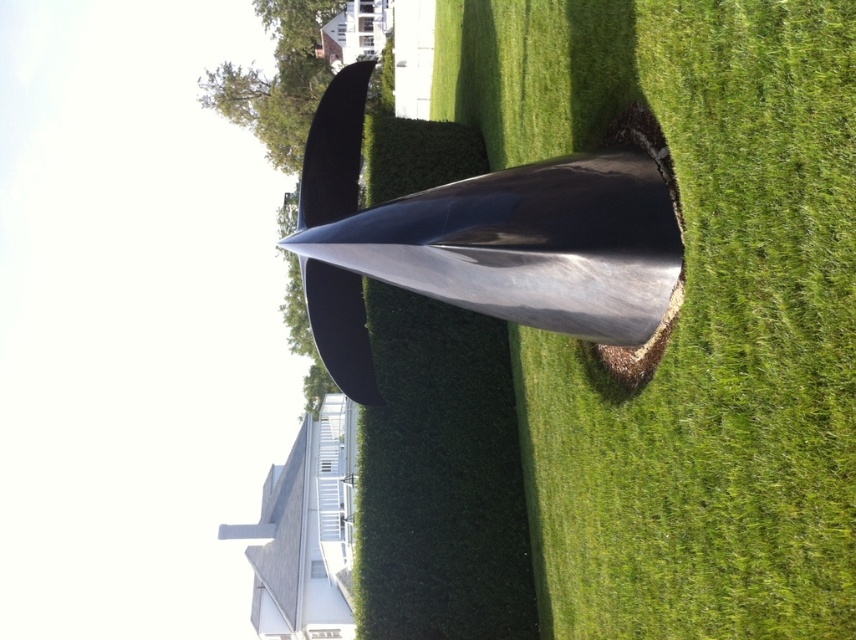
You are a landscape architect designing a garden. You need to place a new statue that is 2 meters wide. The statue must be placed where there is enough space. Based on the image, can the green grass at center accommodate the shiny metallic cone at center and the new statue without overlapping?

The green grass at center has a larger size compared to shiny metallic cone at center. Since the grass area is bigger, it can accommodate both the shiny metallic cone at center and the new 2 meter wide statue without overlapping.

You are standing in front of the sculpture and want to locate two specific points marked on the sculpture. The first point is at coordinates point (669, 360) and the second is at point (516, 237). Which of these points is closer to you?

Point (669, 360) is in front of point (516, 237), so the first point is closer to you.